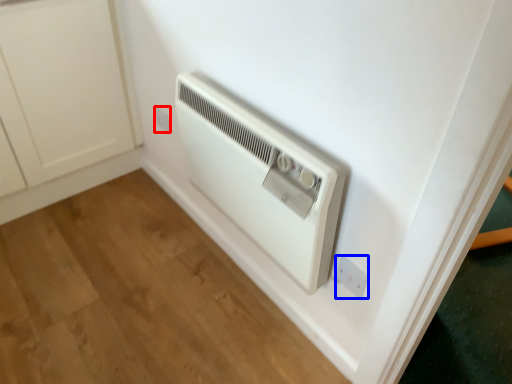
Question: Among these objects, which one is farthest to the camera, electric outlet (highlighted by a red box) or electric outlet (highlighted by a blue box)?

Choices:
 (A) electric outlet
 (B) electric outlet

Answer: (A)